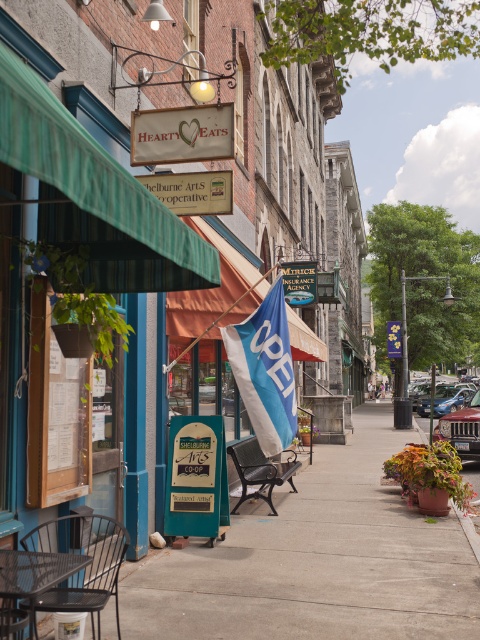
Is green striped awning at upper left behind black wrought iron bench at center?

No, green striped awning at upper left is closer to the viewer.

Does green striped awning at upper left appear over black wrought iron bench at center?

Yes, green striped awning at upper left is above black wrought iron bench at center.

Find the location of a particular element. The image size is (480, 640). green striped awning at upper left is located at coordinates (95, 195).

Is concrete sidewalk at center taller than black wrought iron bench at center?

Yes, concrete sidewalk at center is taller than black wrought iron bench at center.

Does point (407, 552) come behind point (290, 477)?

No, (407, 552) is closer to viewer.

Who is more forward, (240,516) or (298,460)?

Point (240,516) is more forward.

Where is `concrete sidewalk at center`? The image size is (480, 640). concrete sidewalk at center is located at coordinates (315, 561).

Does concrete sidewalk at center have a lesser height compared to wooden menu at left?

Yes.

Is concrete sidewalk at center to the left of wooden menu at left from the viewer's perspective?

No, concrete sidewalk at center is not to the left of wooden menu at left.

Is point (444, 536) behind point (40, 406)?

Yes, point (444, 536) is farther from viewer.

Where is `concrete sidewalk at center`? The width and height of the screenshot is (480, 640). concrete sidewalk at center is located at coordinates (315, 561).